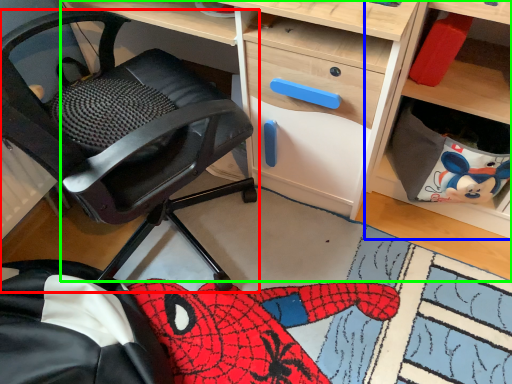
Question: Which object is the closest to the chair (highlighted by a red box)? Choose among these: shelf (highlighted by a blue box) or desk (highlighted by a green box).

Choices:
 (A) shelf
 (B) desk

Answer: (A)